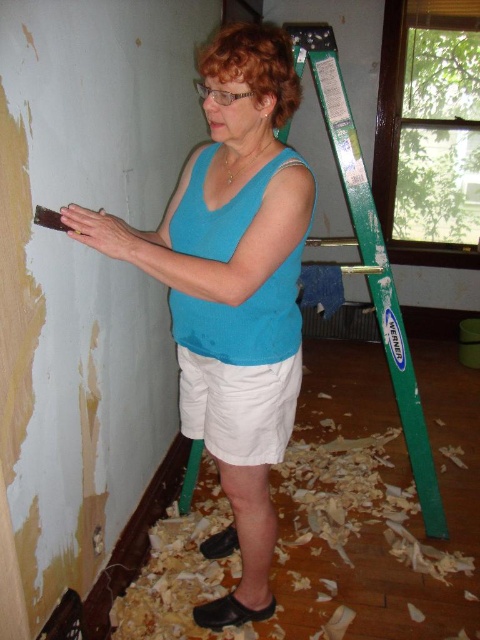
Question: Which of the following is the closest to the observer?

Choices:
 (A) (340, 150)
 (B) (377, 506)
 (C) (269, 593)
 (D) (203, 403)

Answer: (D)

Question: Can you confirm if blue matte tank top at center is thinner than green plastic ladder at right?

Choices:
 (A) no
 (B) yes

Answer: (B)

Question: Estimate the real-world distances between objects in this image. Which object is farther from the green plastic ladder at right?

Choices:
 (A) blue matte tank top at center
 (B) white cotton shorts at center

Answer: (B)

Question: Can you confirm if blue matte tank top at center is bigger than white cotton shorts at center?

Choices:
 (A) yes
 (B) no

Answer: (A)

Question: Is blue matte tank top at center above wooden shavings at lower center?

Choices:
 (A) no
 (B) yes

Answer: (B)

Question: Estimate the real-world distances between objects in this image. Which object is farther from the green plastic ladder at right?

Choices:
 (A) wooden shavings at lower center
 (B) white cotton shorts at center
 (C) blue matte tank top at center

Answer: (B)